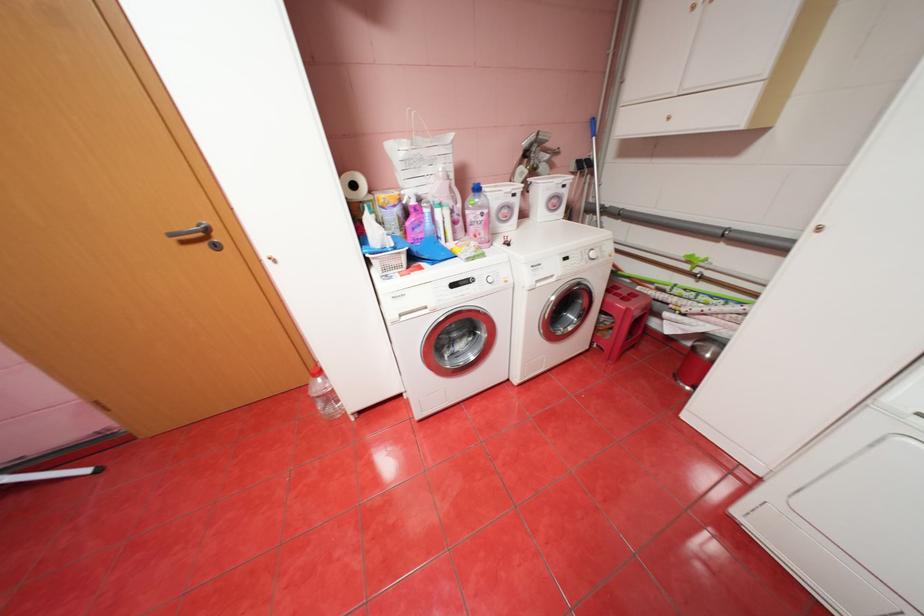
Find where to pull the recessed appliance handle. Please return your answer as a coordinate pair (x, y).

(197, 236)